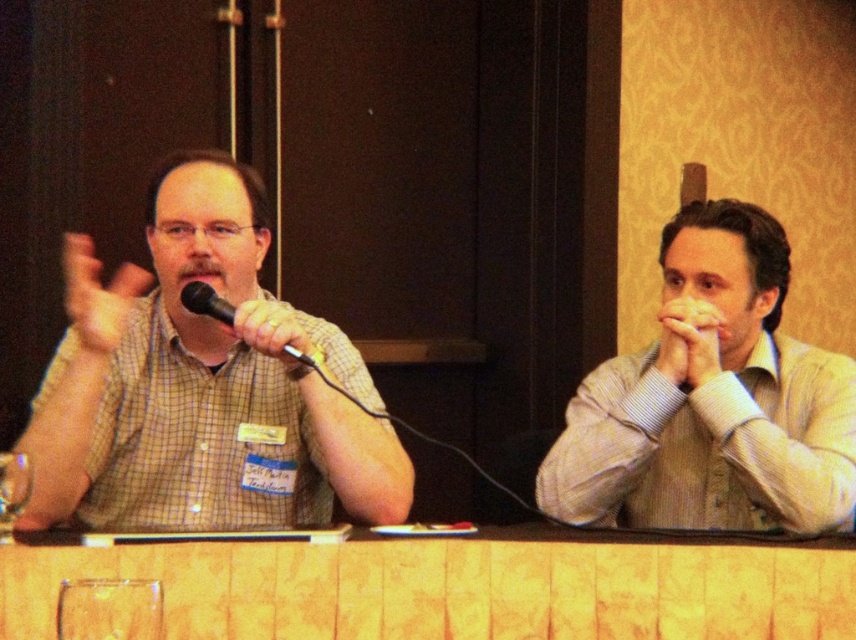
You are an event photographer at the formal event. You need to capture a closeup of the smooth skin hands at center and the light beige corduroy shirt at right. Which object should you focus on first to ensure both are in frame?

The light beige corduroy shirt at right is to the right of smooth skin hands at center. To include both in the frame, focus on the smooth skin hands at center first, then adjust to include the light beige corduroy shirt at right.

You are a photographer positioned at the center of the room. You want to take a photo of the light beige corduroy shirt at right. What are the coordinates where you should aim your camera?

The light beige corduroy shirt at right is located at coordinates point (711, 400), so you should aim your camera at those coordinates to capture it.

You are sitting at the wooden table at center and want to hand a document to the person wearing the light beige corduroy shirt at right. Which direction should you move to reach them?

The wooden table at center is in front of the light beige corduroy shirt at right, so you should move forward to reach them.